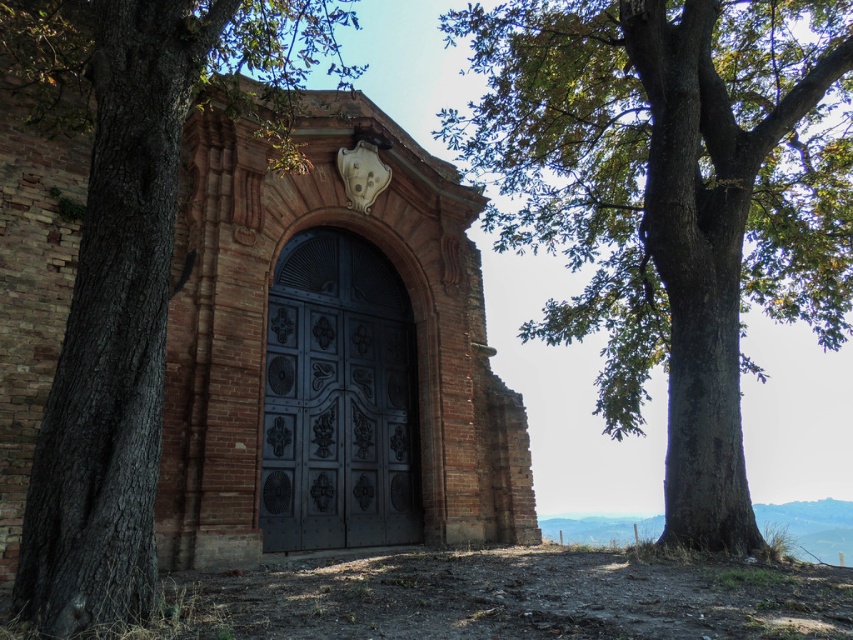
Question: Is green leafy tree at center positioned before dark metal door at center?

Choices:
 (A) no
 (B) yes

Answer: (A)

Question: Which point appears farthest from the camera in this image?

Choices:
 (A) (657, 120)
 (B) (279, 268)

Answer: (B)

Question: Estimate the real-world distances between objects in this image. Which object is closer to the green leafy tree at center?

Choices:
 (A) brown rough bark tree at left
 (B) dark metal door at center

Answer: (B)

Question: Considering the real-world distances, which object is closest to the dark metal door at center?

Choices:
 (A) brown rough bark tree at left
 (B) green leafy tree at center

Answer: (A)

Question: Can you confirm if green leafy tree at center is wider than dark metal door at center?

Choices:
 (A) yes
 (B) no

Answer: (B)

Question: Can you confirm if green leafy tree at center is positioned to the left of brown rough bark tree at left?

Choices:
 (A) no
 (B) yes

Answer: (A)